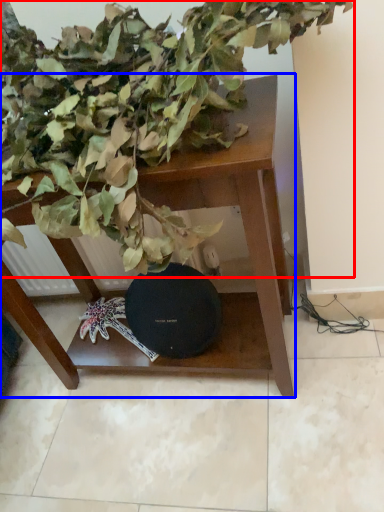
Question: Which object is closer to the camera taking this photo, houseplant (highlighted by a red box) or table (highlighted by a blue box)?

Choices:
 (A) houseplant
 (B) table

Answer: (A)